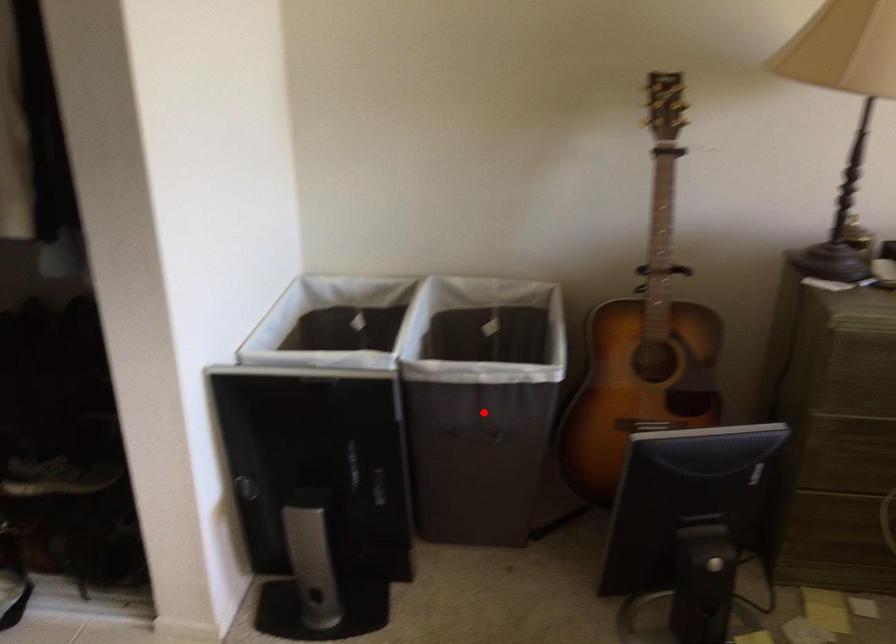
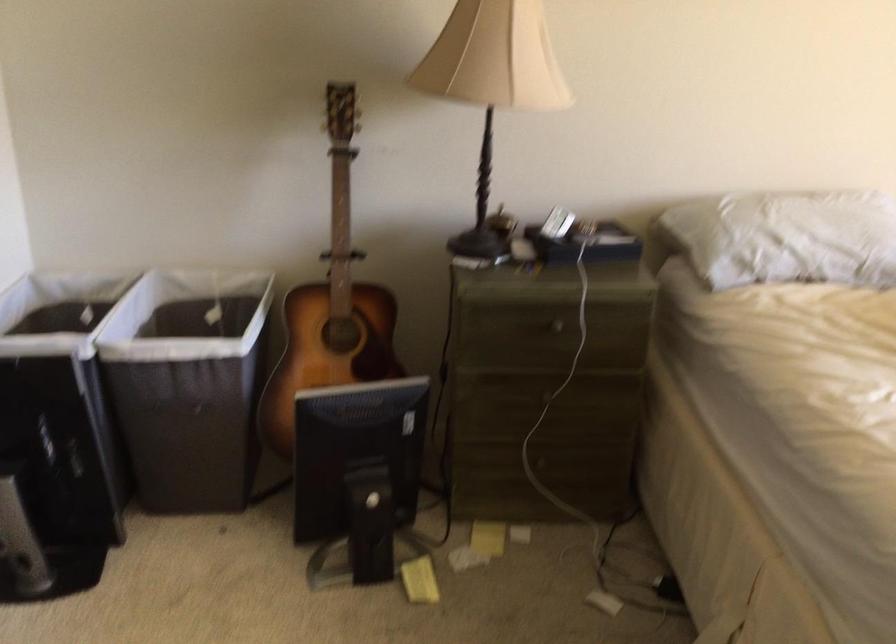
Where in the second image is the point corresponding to the highlighted location from the first image?

(188, 384)